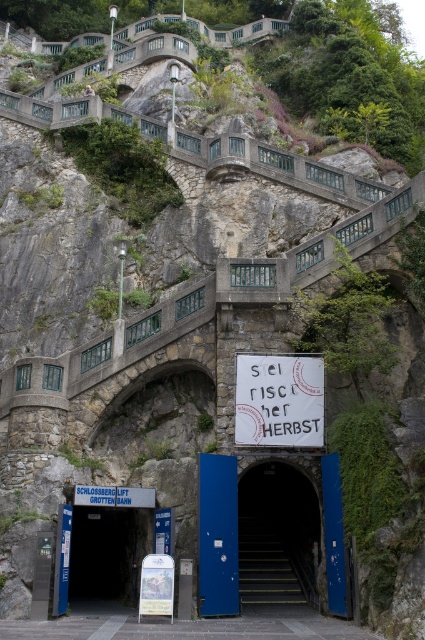
Question: Which of these objects is positioned closest to the blue metal stairs at center?

Choices:
 (A) white paper sign at center
 (B) blue metallic door at center
 (C) yellow/golden metal stairs at center

Answer: (C)

Question: Does white paper sign at center appear over yellow/golden metal stairs at center?

Choices:
 (A) yes
 (B) no

Answer: (A)

Question: Where is white paper sign at center located in relation to yellow/golden metal stairs at center in the image?

Choices:
 (A) below
 (B) above

Answer: (B)

Question: Which point appears farthest from the camera in this image?

Choices:
 (A) (277, 540)
 (B) (246, 493)
 (C) (302, 426)
 (D) (90, 536)

Answer: (D)

Question: Does blue metal stairs at center have a larger size compared to white paper sign at center?

Choices:
 (A) yes
 (B) no

Answer: (A)

Question: Considering the real-world distances, which object is closest to the blue metal stairs at center?

Choices:
 (A) blue metallic door at center
 (B) white paper sign at center

Answer: (B)